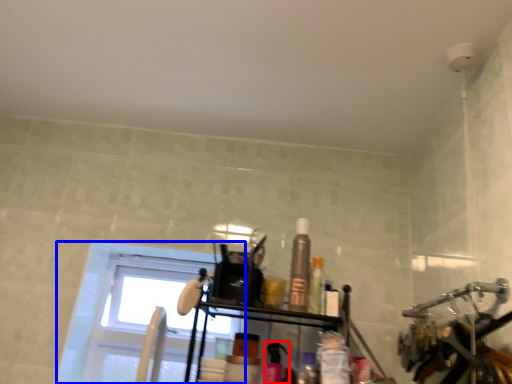
Question: Which point is further to the camera, toiletry (highlighted by a red box) or window (highlighted by a blue box)?

Choices:
 (A) toiletry
 (B) window

Answer: (B)